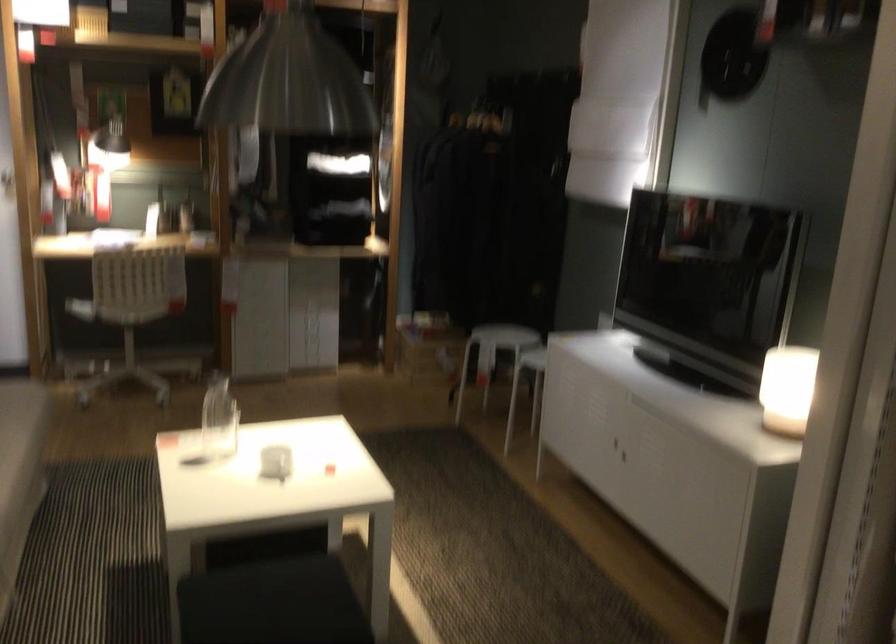
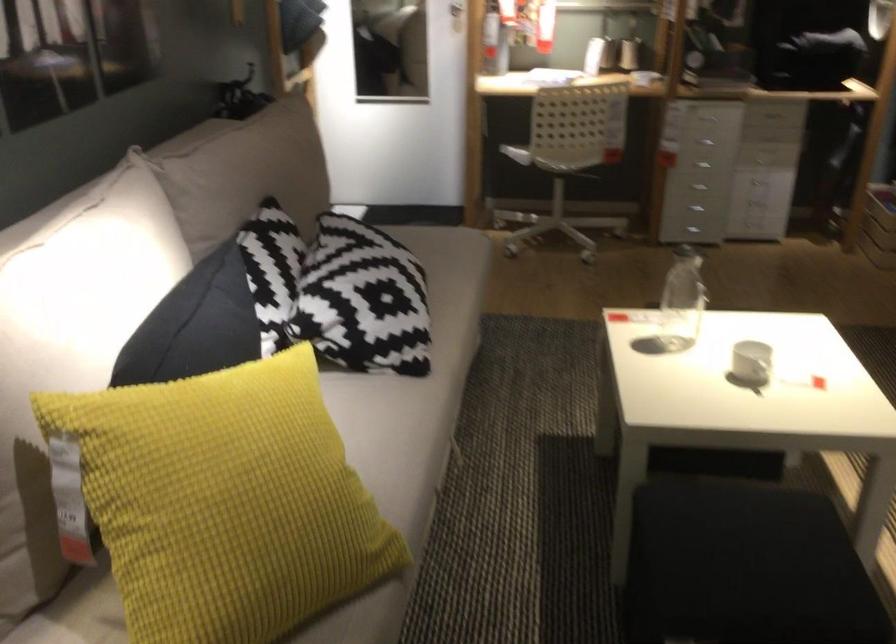
Question: The first image is from the beginning of the video and the second image is from the end. How did the camera likely rotate when shooting the video?

Choices:
 (A) Left
 (B) Right
 (C) Up
 (D) Down

Answer: (A)